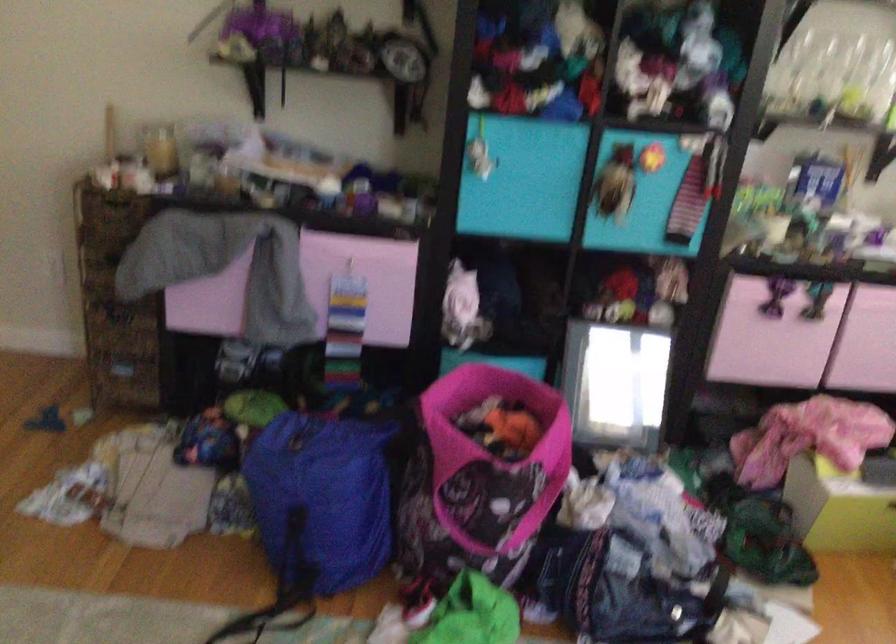
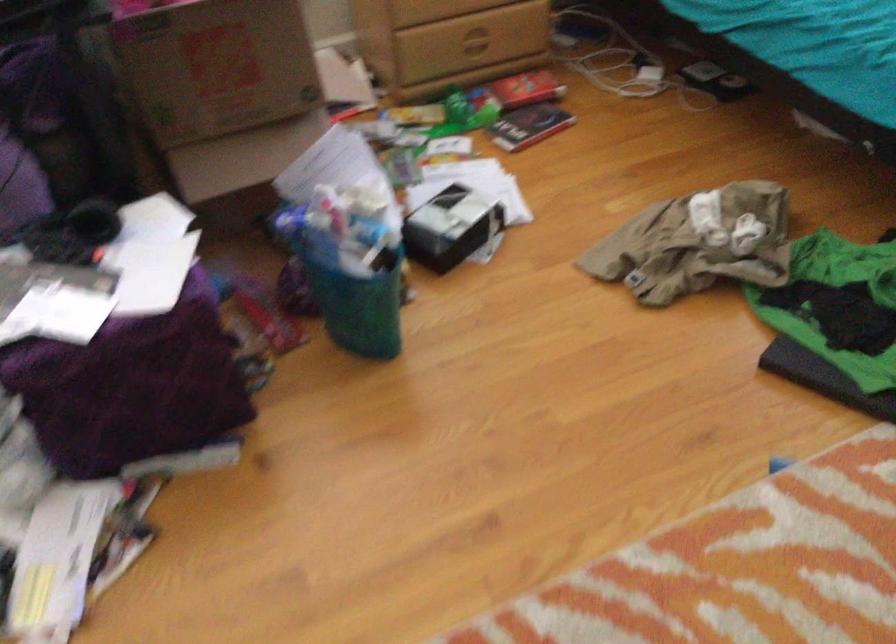
Consider the image. The first image is from the beginning of the video and the second image is from the end. How did the camera likely rotate when shooting the video?

The rotation direction of the camera is right-down.